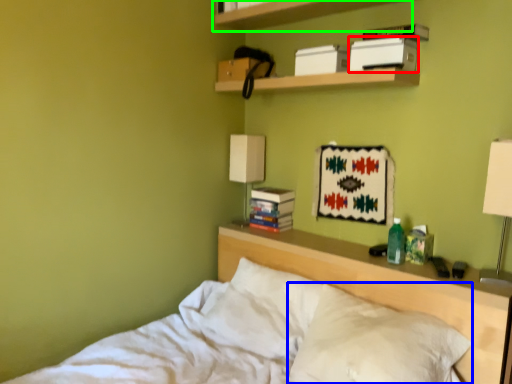
Question: Estimate the real-world distances between objects in this image. Which object is farther from paperback book (highlighted by a red box), pillow (highlighted by a blue box) or shelf (highlighted by a green box)?

Choices:
 (A) pillow
 (B) shelf

Answer: (A)